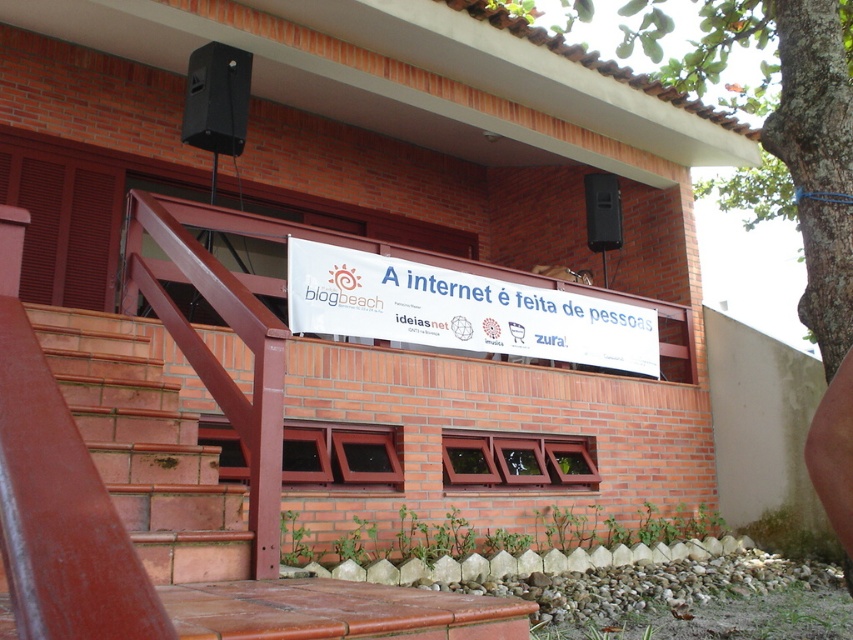
Is black matte speaker at upper center closer to camera compared to black plastic speaker at upper center?

Yes, it is.

Who is higher up, black matte speaker at upper center or black plastic speaker at upper center?

black matte speaker at upper center is above.

Locate an element on the screen. This screenshot has height=640, width=853. black matte speaker at upper center is located at coordinates (216, 99).

Which is more to the right, terracotta brick stairs at lower left or white paper banner at upper center?

white paper banner at upper center is more to the right.

Between terracotta brick stairs at lower left and white paper banner at upper center, which one has less height?

With less height is terracotta brick stairs at lower left.

The image size is (853, 640). Identify the location of terracotta brick stairs at lower left. (144, 449).

Locate an element on the screen. This screenshot has width=853, height=640. terracotta brick stairs at lower left is located at coordinates (144, 449).

Which is behind, point (76, 323) or point (606, 244)?

The point (606, 244) is behind.

Who is more forward, (76, 340) or (611, 227)?

Positioned in front is point (76, 340).

Is point (218, 515) positioned before point (608, 188)?

That is True.

Locate an element on the screen. terracotta brick stairs at lower left is located at coordinates (144, 449).